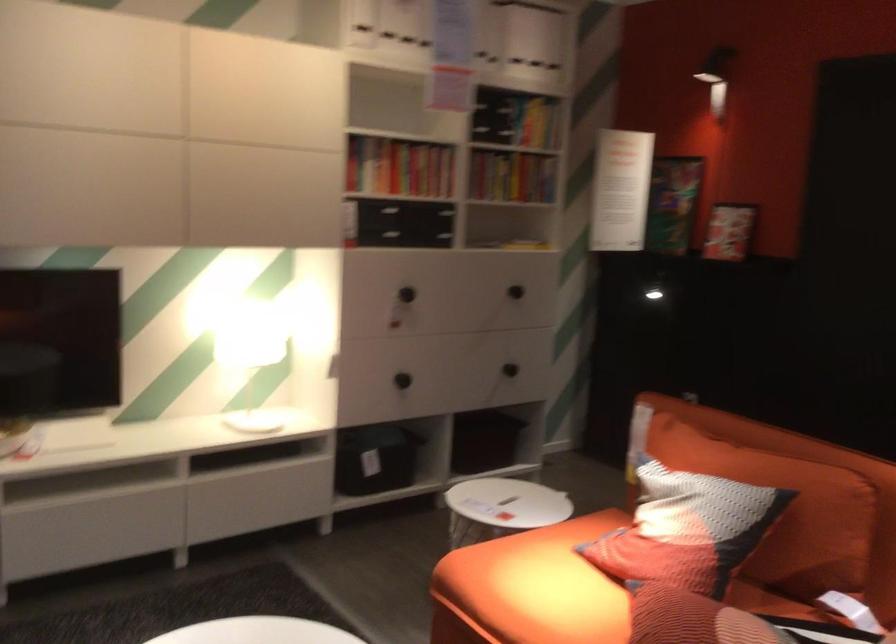
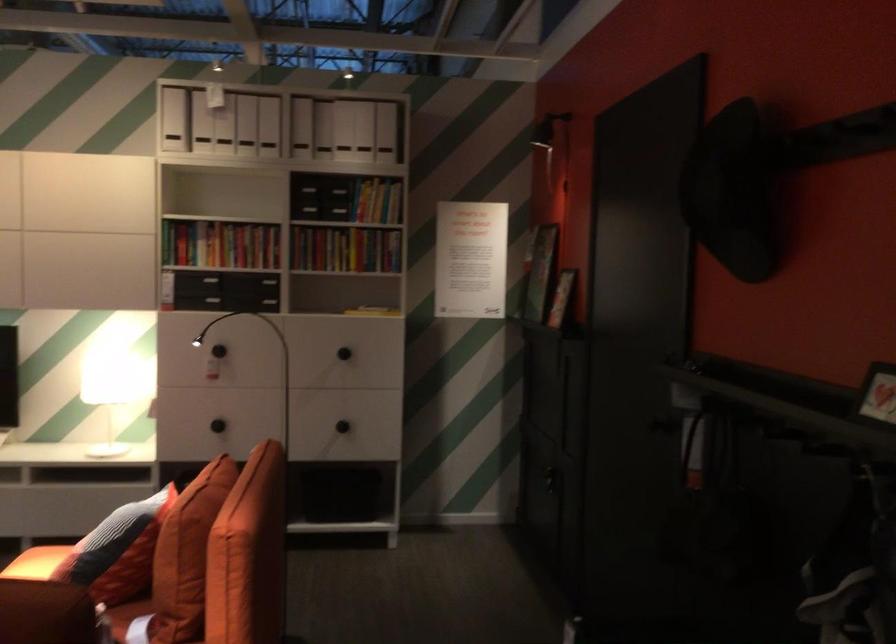
In the second image, find the point that corresponds to (x=426, y=162) in the first image.

(220, 243)